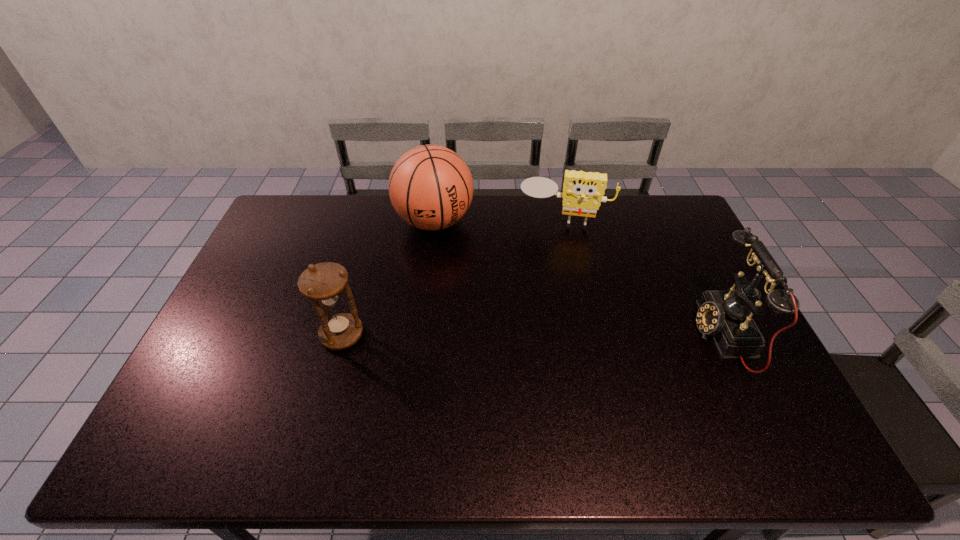
I want to click on free space between the telephone and the sponge, so tap(643, 278).

At what (x,y) coordinates should I click in order to perform the action: click on free area in between the sponge and the hourglass. Please return your answer as a coordinate pair (x, y). Image resolution: width=960 pixels, height=540 pixels. Looking at the image, I should click on (452, 278).

Find the location of a particular element. free space between the basketball and the second object from right to left is located at coordinates (498, 221).

Identify the location of blank region between the telephone and the leftmost object. (533, 335).

This screenshot has width=960, height=540. I want to click on free space between the sponge and the second object from left to right, so click(498, 221).

Image resolution: width=960 pixels, height=540 pixels. Find the location of `free space between the hourglass and the rightmost object`. free space between the hourglass and the rightmost object is located at coordinates (533, 335).

Identify which object is located as the second nearest to the hourglass. Please provide its 2D coordinates. Your answer should be formatted as a tuple, i.e. [(x, y)], where the tuple contains the x and y coordinates of a point satisfying the conditions above.

[(583, 192)]

Find the location of a particular element. object that can be found as the second closest to the basketball is located at coordinates (323, 283).

Find the location of a particular element. Image resolution: width=960 pixels, height=540 pixels. free region that satisfies the following two spatial constraints: 1. on the back side of the third object from right to left; 2. on the right side of the sponge is located at coordinates (435, 221).

This screenshot has height=540, width=960. I want to click on free location that satisfies the following two spatial constraints: 1. on the front side of the basketball; 2. on the dial of the telephone, so click(421, 335).